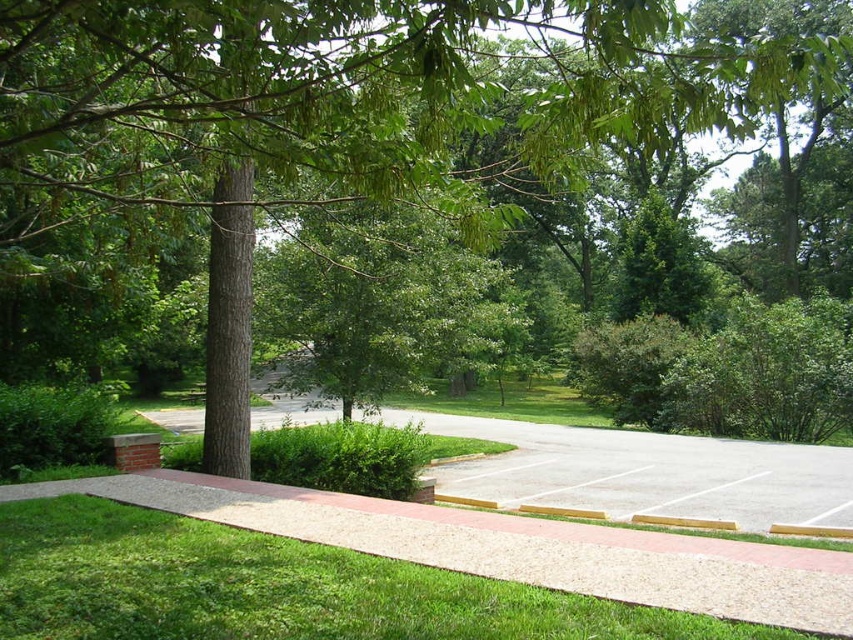
Can you confirm if green grass at lower left is positioned below gray asphalt parking lot at center?

No, green grass at lower left is not below gray asphalt parking lot at center.

Does point (70, 532) come farther from viewer compared to point (607, 518)?

No, (70, 532) is closer to viewer.

Who is more forward, [260,596] or [582,465]?

Point [260,596]

Identify the location of green grass at lower left. (276, 588).